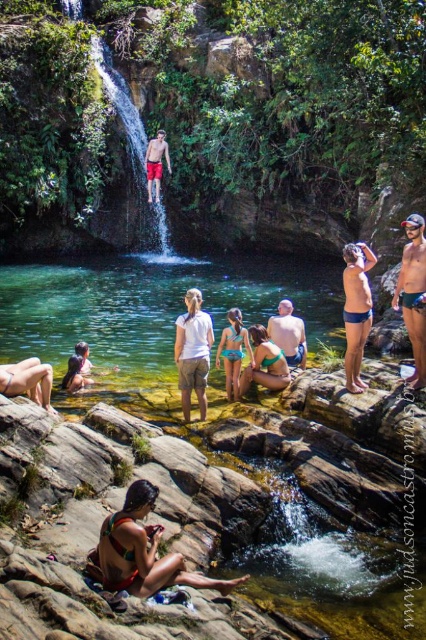
Is blue matte shorts at center smaller than matte red shorts at center?

Incorrect, blue matte shorts at center is not smaller in size than matte red shorts at center.

Is blue matte shorts at center above matte red shorts at center?

No, blue matte shorts at center is not above matte red shorts at center.

Is point (363, 289) closer to viewer compared to point (152, 166)?

That is True.

At what (x,y) coordinates should I click in order to perform the action: click on blue matte shorts at center. Please return your answer as a coordinate pair (x, y). Looking at the image, I should click on (356, 308).

Is blue matte shorts at center thinner than smooth skin man at center?

No.

Which is behind, point (348, 348) or point (302, 364)?

The point (302, 364) is more distant.

I want to click on blue matte shorts at center, so click(356, 308).

Is point (302, 326) positioned behind point (89, 365)?

No, (302, 326) is closer to viewer.

How far apart are smooth skin man at center and matte white bikini at lower left?

They are 8.02 meters apart.

Which is in front, point (290, 365) or point (85, 371)?

Point (290, 365) is in front.

Find the location of a particular element. This screenshot has width=426, height=640. smooth skin man at center is located at coordinates pyautogui.click(x=288, y=333).